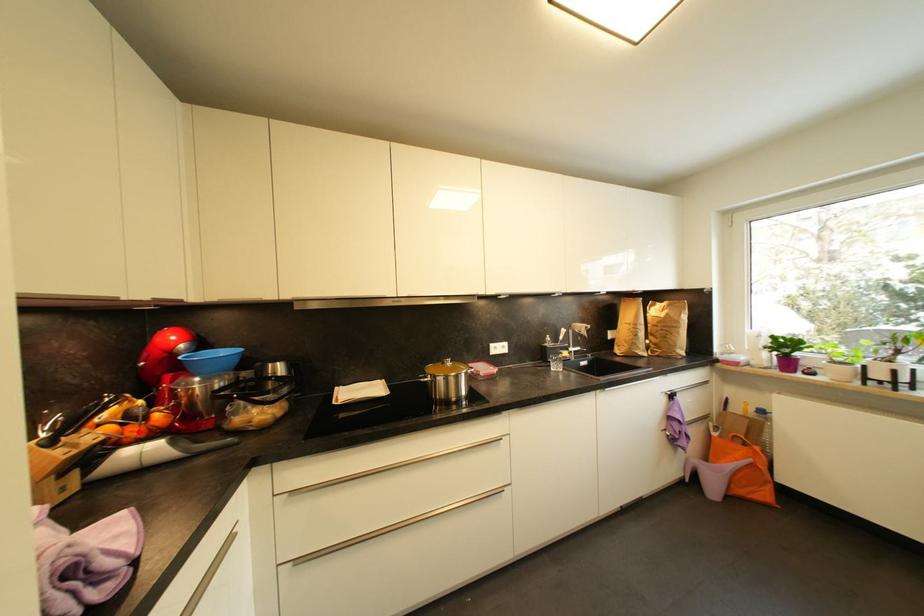
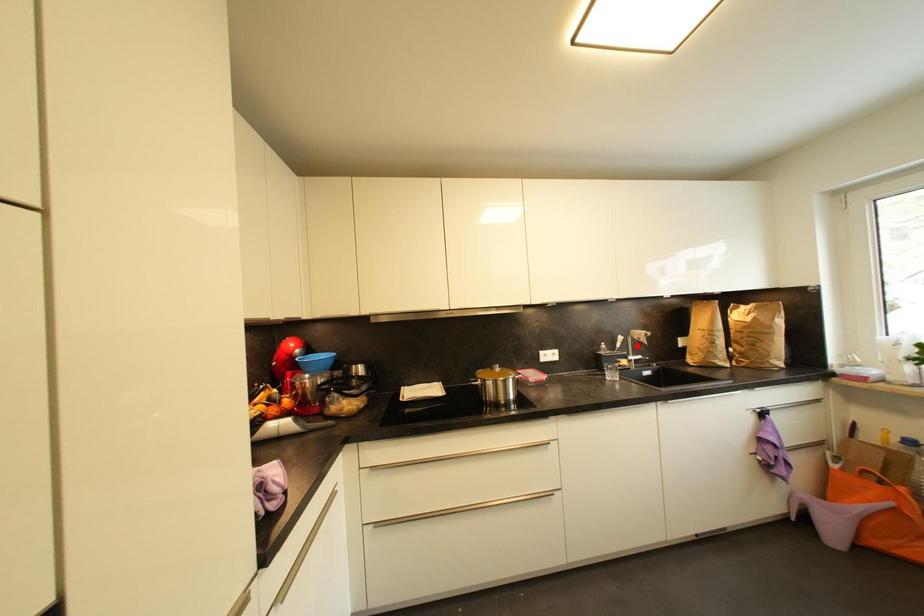
I am providing you with two images of the same scene from different viewpoints. A red point is marked on the first image and another point is marked on the second image. Are the points marked in image1 and image2 representing the same 3D position?

No